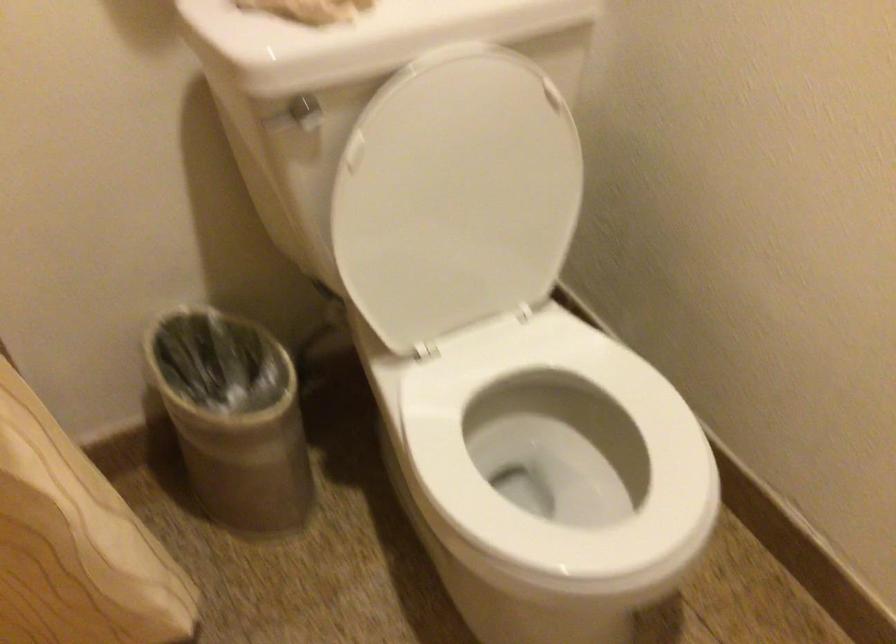
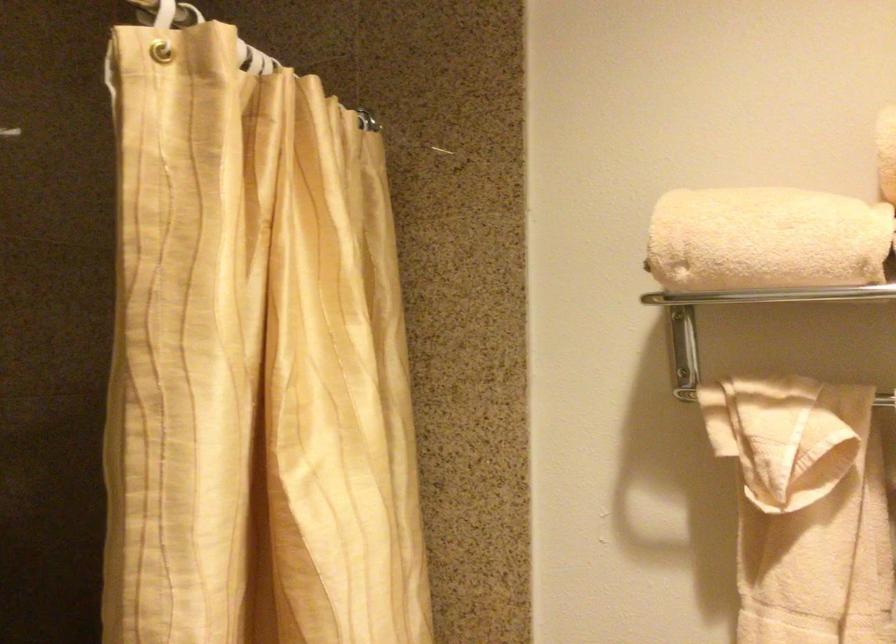
From the picture: How did the camera likely rotate?

The camera rotated toward left-up.